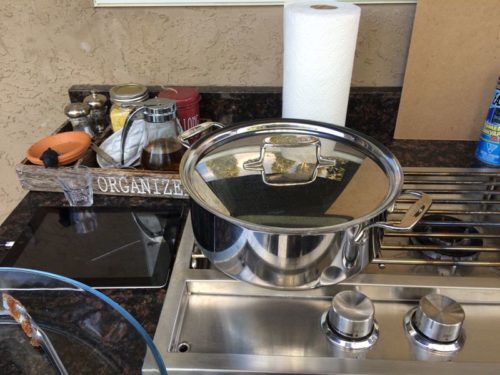
At what (x,y) coordinates should I click in order to perform the action: click on cleaning product. Please return your answer as a coordinate pair (x, y). This screenshot has height=375, width=500. Looking at the image, I should click on (491, 135).